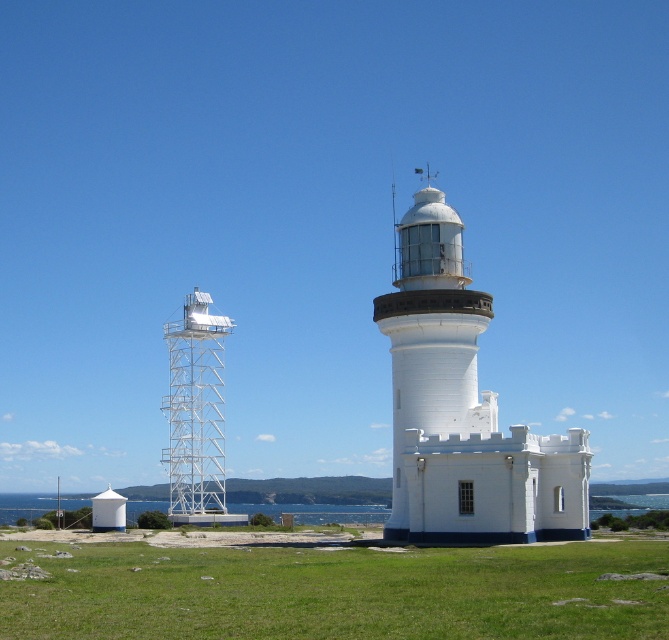
You are a photographer planning to capture the white smooth lighthouse at center and the green grass at lower center in a single frame. Based on the scene, which object occupies a bigger area in the image?

The green grass at lower center has a larger size compared to the white smooth lighthouse at center, so it occupies a bigger area in the image.

You are standing at the point marked by the coordinates point (339, 593) in the image. Looking around, what do you see immediately around you?

You are standing on green grass at lower center, as indicated by the point (339, 593).

You are a photographer planning to capture the entire view of the white metallic tower at left and the green grass at lower center in a single frame. Based on their widths, which object should you focus on to ensure both are fully visible without cropping?

The green grass at lower center is wider than the white metallic tower at left, so focusing on the green grass at lower center would ensure both objects are fully visible in the frame.